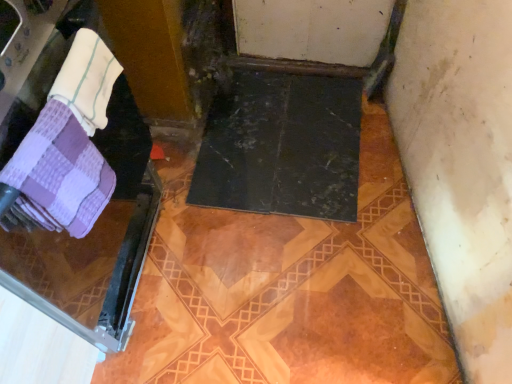
Question: Is the position of purple checkered towel at left more distant than that of purple checkered towel at left, the first towel in the bottom-to-top sequence?

Choices:
 (A) yes
 (B) no

Answer: (B)

Question: Does purple checkered towel at left have a smaller size compared to purple checkered towel at left, placed as the 2th towel when sorted from top to bottom?

Choices:
 (A) no
 (B) yes

Answer: (A)

Question: Is purple checkered towel at left wider than purple checkered towel at left, placed as the 2th towel when sorted from top to bottom?

Choices:
 (A) no
 (B) yes

Answer: (B)

Question: Is purple checkered towel at left taller than purple checkered towel at left, placed as the 2th towel when sorted from top to bottom?

Choices:
 (A) yes
 (B) no

Answer: (A)

Question: Could you tell me if purple checkered towel at left is turned towards purple checkered towel at left, the first towel in the bottom-to-top sequence?

Choices:
 (A) no
 (B) yes

Answer: (B)

Question: From the image's perspective, is purple checkered towel at left on top of purple checkered towel at left, the first towel in the bottom-to-top sequence?

Choices:
 (A) yes
 (B) no

Answer: (B)

Question: Does purple checkered towel at left, placed as the 2th towel when sorted from top to bottom, have a greater width compared to purple checkered towel at left?

Choices:
 (A) yes
 (B) no

Answer: (B)

Question: Is purple checkered towel at left, placed as the 2th towel when sorted from top to bottom, to the left of purple checkered towel at left from the viewer's perspective?

Choices:
 (A) no
 (B) yes

Answer: (A)

Question: Is purple checkered towel at left, the first towel in the bottom-to-top sequence, to the right of purple checkered towel at left from the viewer's perspective?

Choices:
 (A) yes
 (B) no

Answer: (A)

Question: Considering the relative sizes of purple checkered towel at left, the first towel in the bottom-to-top sequence, and purple checkered towel at left in the image provided, is purple checkered towel at left, the first towel in the bottom-to-top sequence, thinner than purple checkered towel at left?

Choices:
 (A) yes
 (B) no

Answer: (A)

Question: Is purple checkered towel at left, the first towel in the bottom-to-top sequence, closer to camera compared to purple checkered towel at left?

Choices:
 (A) yes
 (B) no

Answer: (B)

Question: Considering the relative positions of white terry cloth towel at upper left, the 2th towel in the bottom-to-top sequence, and purple checkered towel at left, the first towel in the bottom-to-top sequence, in the image provided, is white terry cloth towel at upper left, the 2th towel in the bottom-to-top sequence, to the right of purple checkered towel at left, the first towel in the bottom-to-top sequence, from the viewer's perspective?

Choices:
 (A) no
 (B) yes

Answer: (B)